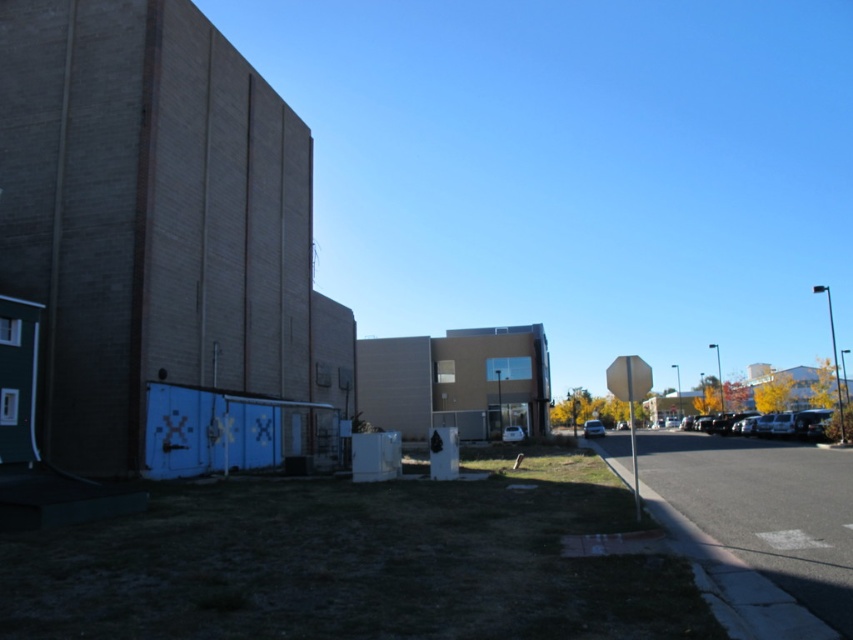
Consider the image. You are a delivery person trying to park your truck in a tight space between the metallic silver car at center and the shiny silver sedan at center. The truck is 2.2 meters tall. Can you safely park your truck there without hitting the roof?

The metallic silver car at center is taller than the shiny silver sedan at center. Since the truck is 2.2 meters tall, you need to check the minimum height clearance between the two cars. If the space between them is at least 2.2 meters tall, then it should be safe. However, since the description only states the car is taller than the sedan, but doesn answer provide exact measurements of the available height, it is uncertain whether the truck can fit safely. Please verify the actual height clearance before

You are a parking attendant who needs to fit both the metallic silver car at center and the white matte car at center into a parking spot that can only accommodate vehicles up to the height of the shorter car. Which car should you prioritize to park first?

The metallic silver car at center is much taller than the white matte car at center, so you should prioritize parking the white matte car at center first since it meets the height requirement of the parking spot.